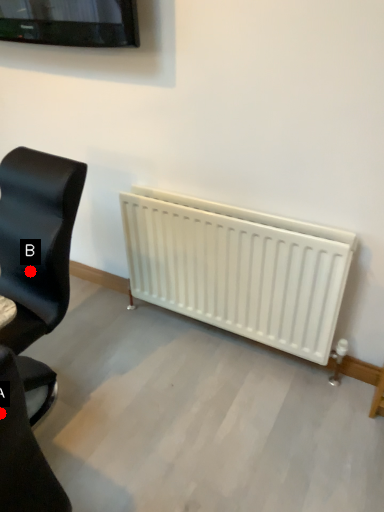
Question: Two points are circled on the image, labeled by A and B beside each circle. Which point is farther to the camera?

Choices:
 (A) A is further
 (B) B is further

Answer: (B)